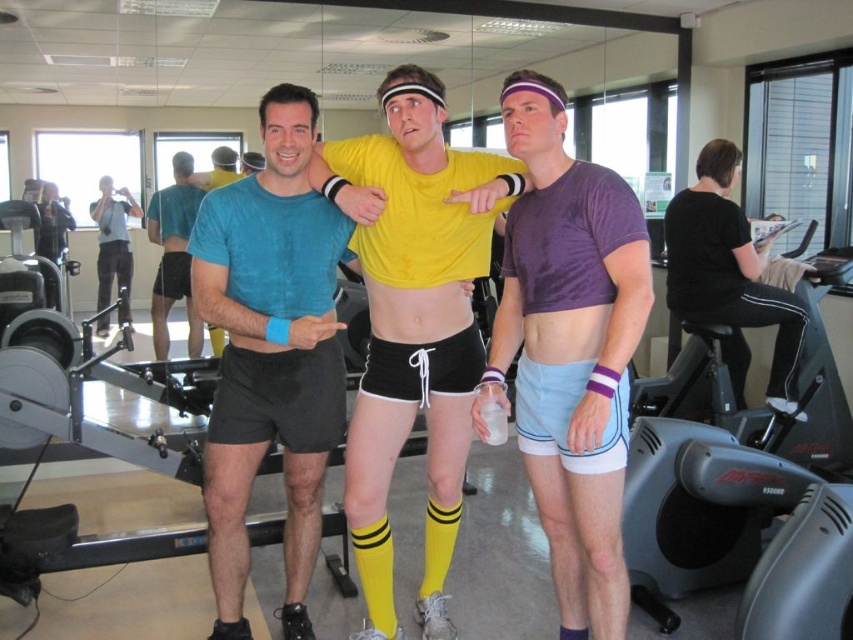
You are a photographer positioned 2 meters away from the two men in the image. You want to take a photo that includes both the yellow matte shorts at center and the black matte shorts at center. Will you be able to capture both in a single frame if your camera has a 1.8 meter wide field of view?

The yellow matte shorts at center and black matte shorts at center are 1.79 meters apart from each other. Since the distance between them is just under the camera field of view of 1.8 meters, the photographer can capture both in a single frame.